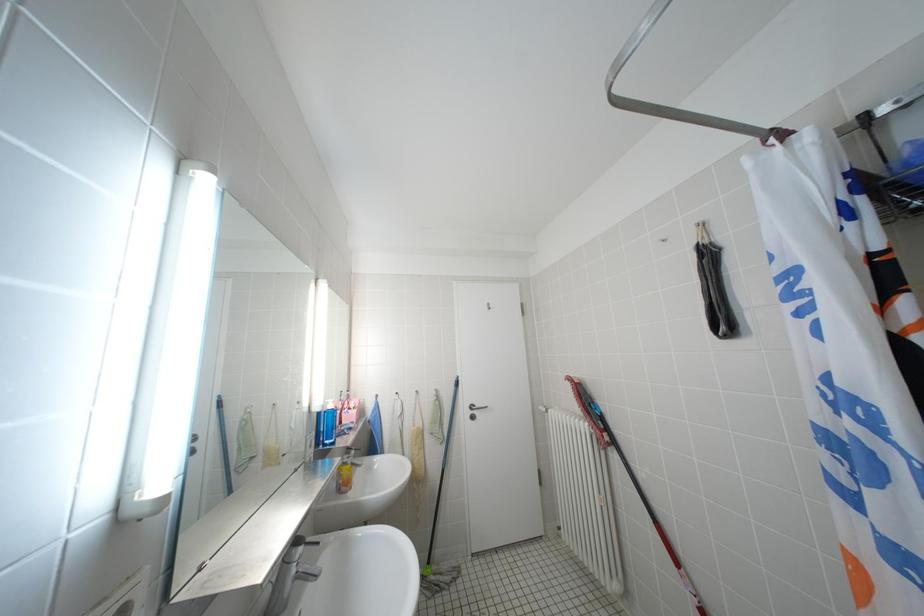
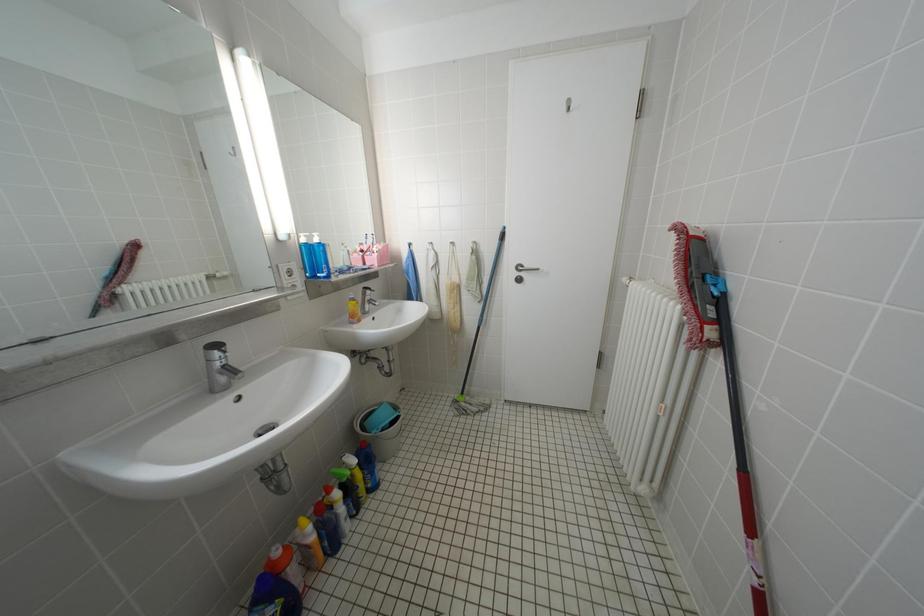
The first image is from the beginning of the video and the second image is from the end. How did the camera likely rotate when shooting the video?

The rotation direction of the camera is left-down.